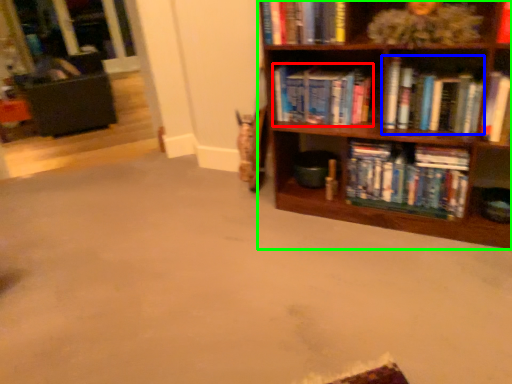
Question: Considering the real-world distances, which object is closest to book (highlighted by a red box)? book (highlighted by a blue box) or bookcase (highlighted by a green box).

Choices:
 (A) book
 (B) bookcase

Answer: (B)